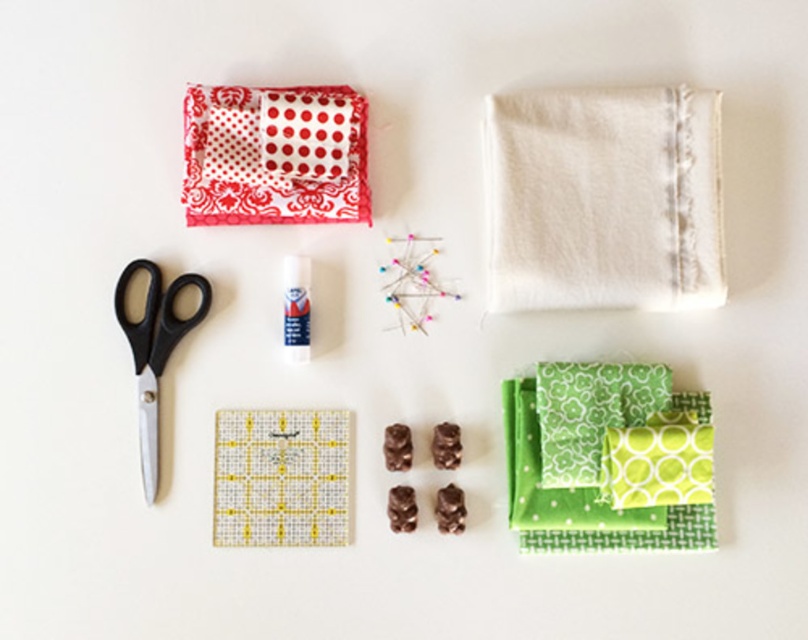
Question: Which object appears closest to the camera in this image?

Choices:
 (A) red polka dot fabric at upper left
 (B) green fabric at center right
 (C) black plastic scissors at left
 (D) white cotton cloth at upper right

Answer: (D)

Question: Which of the following is the closest to the observer?

Choices:
 (A) black plastic scissors at left
 (B) green fabric at center right
 (C) red polka dot fabric at upper left
 (D) white cotton cloth at upper right

Answer: (D)

Question: Is white cotton cloth at upper right to the left of black plastic scissors at left from the viewer's perspective?

Choices:
 (A) no
 (B) yes

Answer: (A)

Question: Which point appears farthest from the camera in this image?

Choices:
 (A) (549, 256)
 (B) (541, 445)
 (C) (226, 93)
 (D) (142, 348)

Answer: (C)

Question: Is white cotton cloth at upper right in front of black plastic scissors at left?

Choices:
 (A) no
 (B) yes

Answer: (B)

Question: Can you confirm if white cotton cloth at upper right is wider than black plastic scissors at left?

Choices:
 (A) yes
 (B) no

Answer: (A)